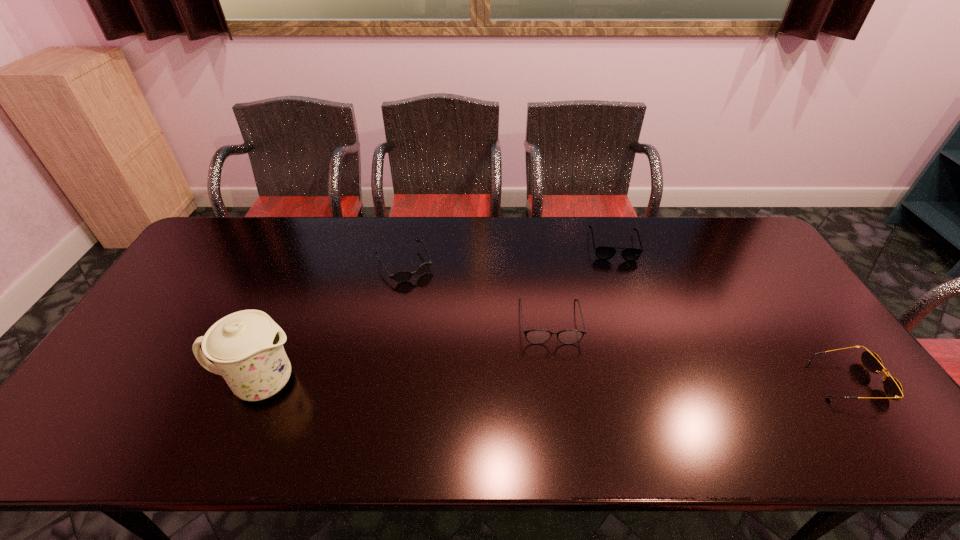
Find the location of a particular element. free space on the desktop that is between the leftmost object and the rightmost object and is positioned on the front-facing side of the farther spectacles is located at coordinates 640,382.

The image size is (960, 540). Find the location of `vacant spot on the desktop that is between the tallest object and the rightmost object and is positioned on the lenses of the farther sunglasses`. vacant spot on the desktop that is between the tallest object and the rightmost object and is positioned on the lenses of the farther sunglasses is located at coordinates click(x=480, y=382).

Locate an element on the screen. This screenshot has width=960, height=540. vacant space on the desktop that is between the tallest object and the nearer sunglasses and is positioned on the front-facing side of the left spectacles is located at coordinates (558, 382).